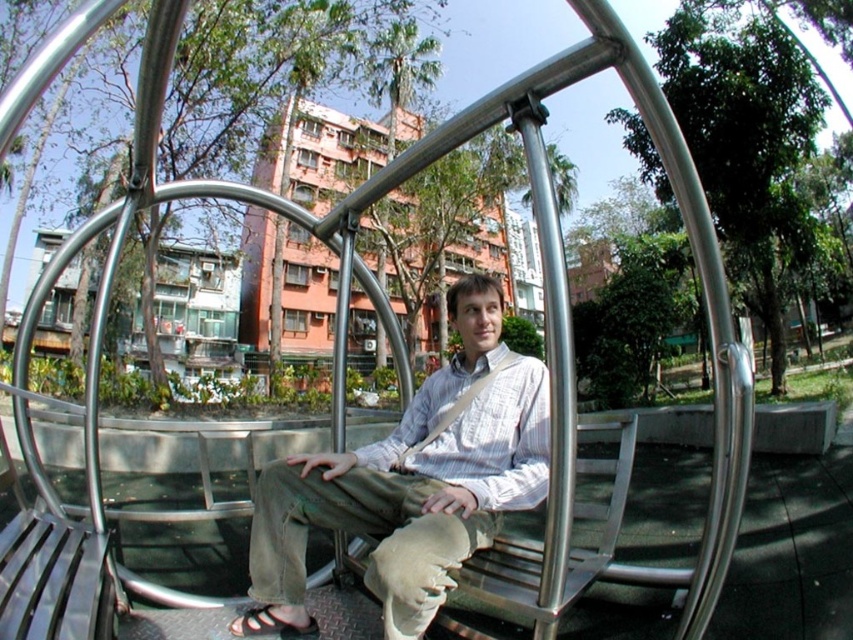
You are a photographer trying to capture the person on the swing. You notice the light brown cotton pants at center and the white fabric strap at center. Which object should you focus on first if you want to ensure both are in sharp focus?

The light brown cotton pants at center is in front of the white fabric strap at center, so focusing on the light brown cotton pants at center first will help ensure both are in sharp focus since it is closer to the camera.

You are a fashion designer observing a person sitting on a swing in a park. You notice the light brown cotton pants at center and the black leather sandal at lower center. Which clothing item is positioned higher on the person?

The light brown cotton pants at center is taller than the black leather sandal at lower center, so the light brown cotton pants at center is positioned higher on the person.

You are a photographer aiming to capture the person on the swing from a low angle to emphasize their footwear. Given the positions of the light brown cotton pants at center and the black leather sandal at lower center, will the sandal be fully visible in the shot?

The light brown cotton pants at center is located above the black leather sandal at lower center, so the sandal may be partially obscured by the pants. Adjust the angle to ensure the sandal is fully visible.